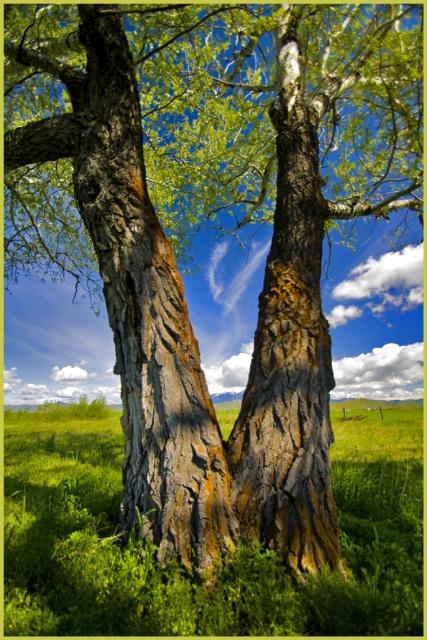
You are a gardener planning to plant a new flower bed between the green grass at center and the rough bark tree trunk at center. Based on the size of the two areas, which area should you choose to ensure the flower bed has enough space?

The green grass at center is larger in size than the rough bark tree trunk at center, so you should choose the green grass at center for the flower bed to ensure there is enough space.

You are a gardener who wants to plant a new tree in the field. The new tree will grow to be taller than the green grass at center. Will the new tree be taller than the rough bark tree trunk at center?

The green grass at center is not as tall as the rough bark tree trunk at center. Since the new tree will grow taller than the green grass at center, it might be taller than the rough bark tree trunk at center, but we need more information about the new tree to confirm.

You are a drone operator who needs to land a drone on the green grass at center. The drone has a GPS system that requires coordinates to land. What are the coordinates where you should direct the drone to land?

The coordinates for the green grass at center are at point [224,563], so you should direct the drone to land there.